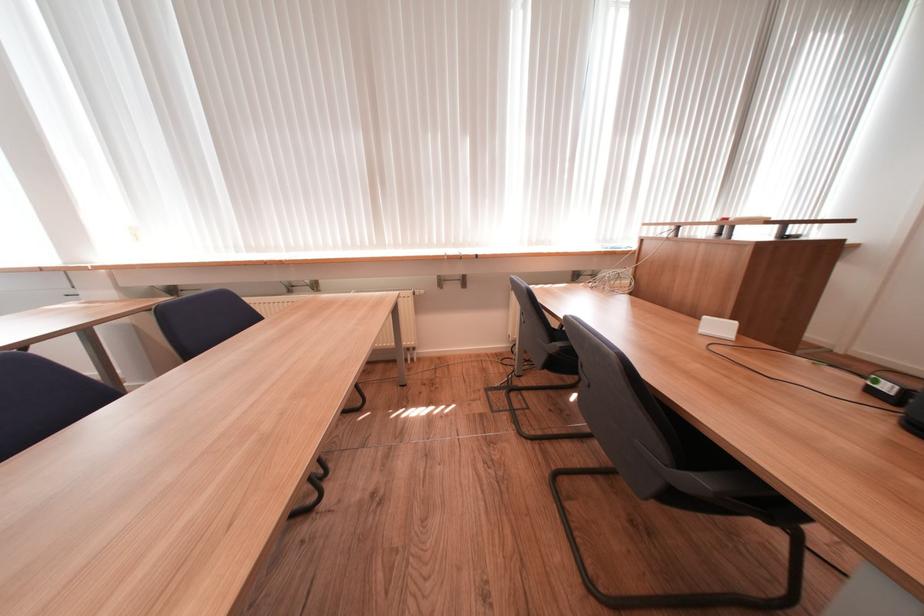
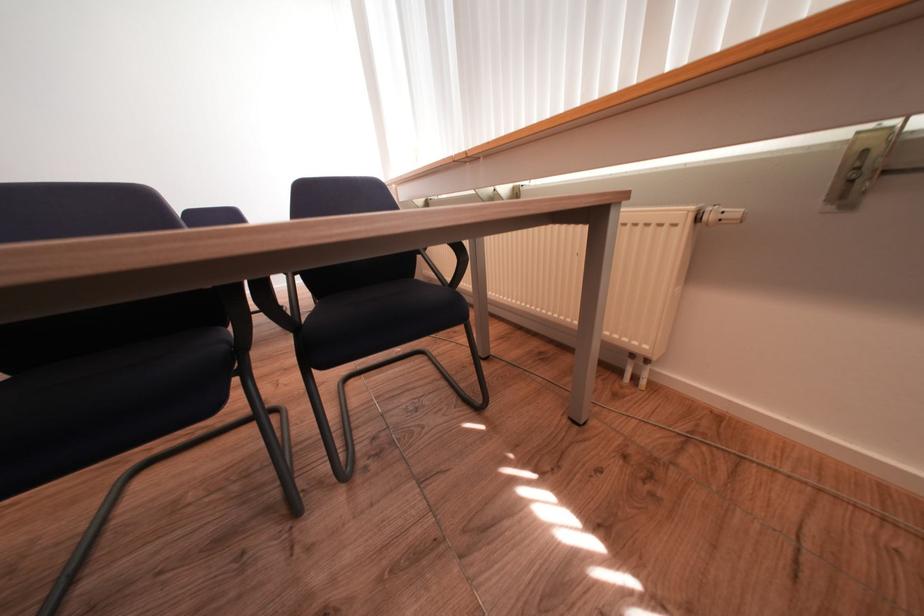
Where in the second image is the point corresponding to [431,294] from the first image?

(745, 215)